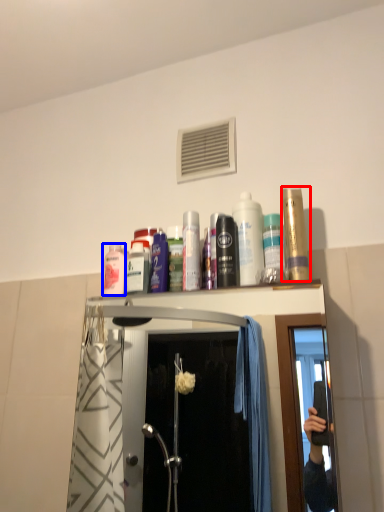
Question: Among these objects, which one is farthest to the camera, mouthwash (highlighted by a red box) or mouthwash (highlighted by a blue box)?

Choices:
 (A) mouthwash
 (B) mouthwash

Answer: (B)